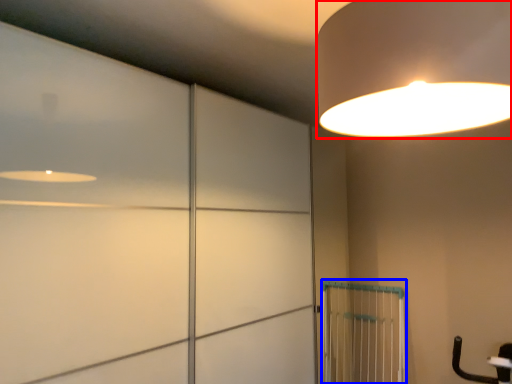
Question: Which point is further to the camera, lamp (highlighted by a red box) or cage (highlighted by a blue box)?

Choices:
 (A) lamp
 (B) cage

Answer: (B)